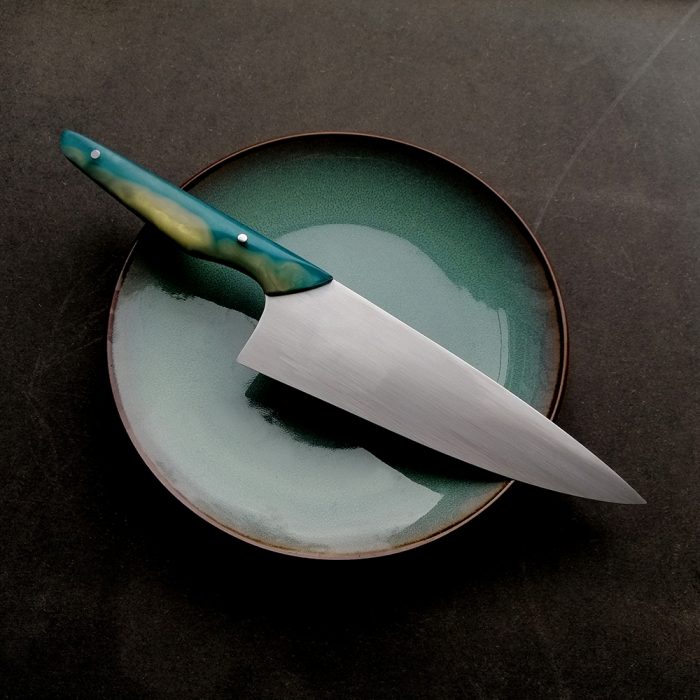
At what (x,y) coordinates should I click in order to perform the action: click on handle. Please return your answer as a coordinate pair (x, y). The image size is (700, 700). Looking at the image, I should click on (157, 203).